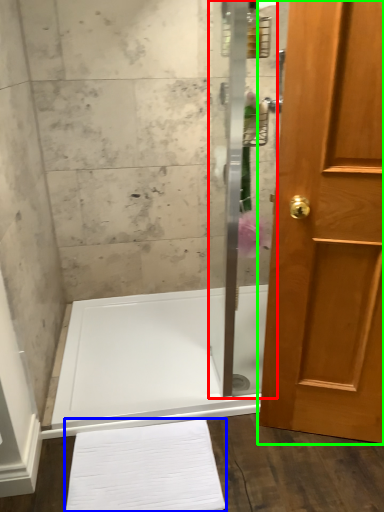
Question: Which object is positioned farthest from shower door (highlighted by a red box)? Select from bath towel (highlighted by a blue box) and door (highlighted by a green box).

Choices:
 (A) bath towel
 (B) door

Answer: (B)